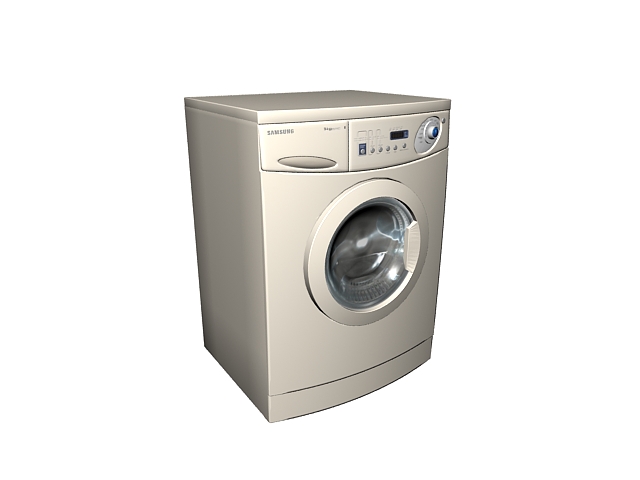
Identify the location of blue knob. This screenshot has height=480, width=640. (434, 129).